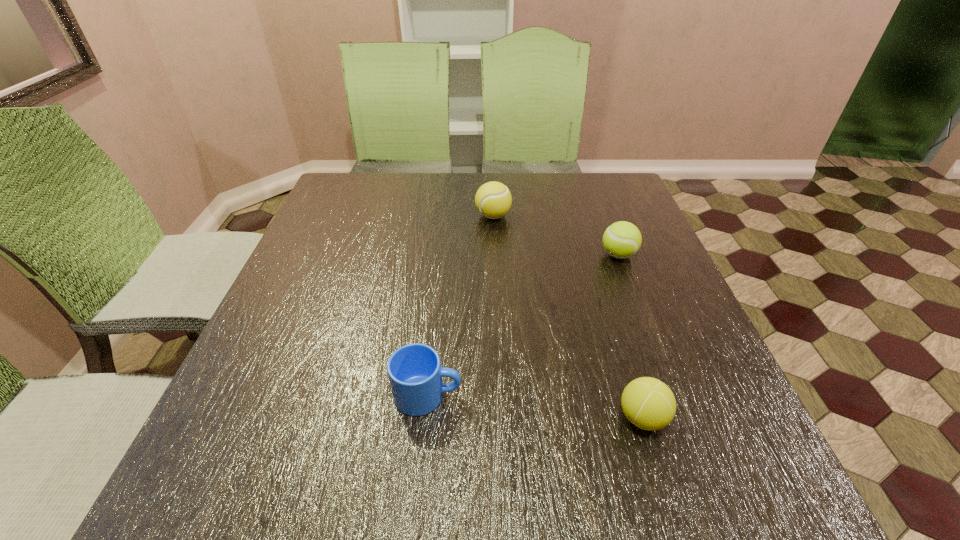
Locate which tennis ball ranks second in proximity to the third nearest object. Please provide its 2D coordinates. Your answer should be formatted as a tuple, i.e. [(x, y)], where the tuple contains the x and y coordinates of a point satisfying the conditions above.

[(648, 403)]

The height and width of the screenshot is (540, 960). I want to click on vacant space that satisfies the following two spatial constraints: 1. on the side of the leftmost object with the handle; 2. on the back side of the nearest tennis ball, so click(x=425, y=417).

Where is `vacant area in the image that satisfies the following two spatial constraints: 1. on the front side of the second farthest object; 2. on the side of the mug with the handle`? The width and height of the screenshot is (960, 540). vacant area in the image that satisfies the following two spatial constraints: 1. on the front side of the second farthest object; 2. on the side of the mug with the handle is located at coordinates (672, 395).

Find the location of a particular element. free location that satisfies the following two spatial constraints: 1. on the side of the mug with the handle; 2. on the right side of the nearest tennis ball is located at coordinates (425, 417).

Image resolution: width=960 pixels, height=540 pixels. I want to click on vacant region that satisfies the following two spatial constraints: 1. on the side of the mug with the handle; 2. on the left side of the nearest tennis ball, so click(425, 417).

Locate an element on the screen. vacant point that satisfies the following two spatial constraints: 1. on the side of the leftmost object with the handle; 2. on the right side of the nearest tennis ball is located at coordinates (425, 417).

This screenshot has width=960, height=540. I want to click on vacant space that satisfies the following two spatial constraints: 1. on the front side of the farthest object; 2. on the side of the leftmost object with the handle, so click(500, 395).